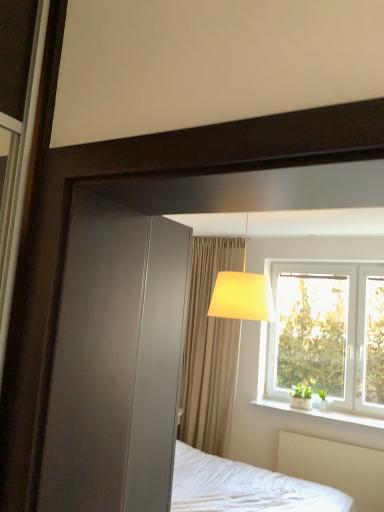
This screenshot has width=384, height=512. Identify the location of blank space above white textured radiator at lower right (from a real-world perspective). (334, 435).